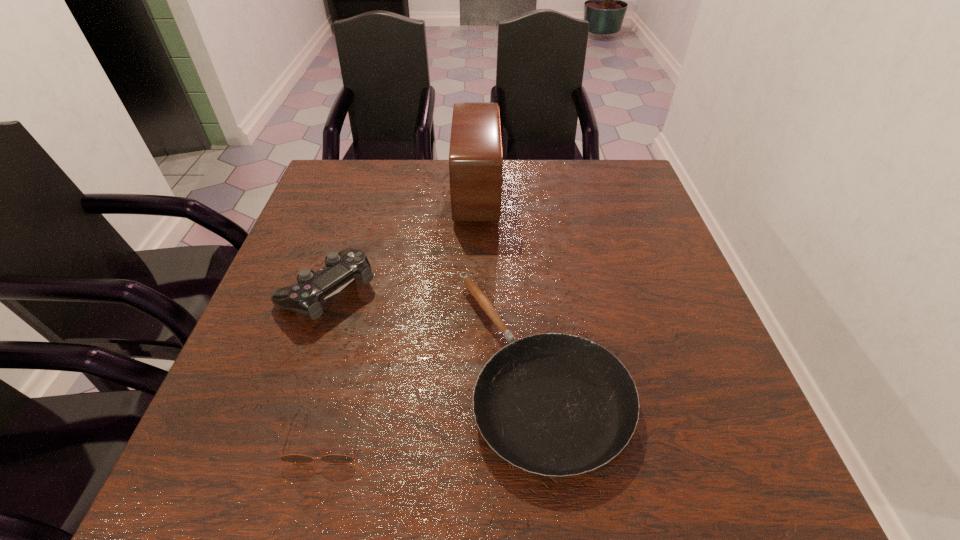
Where is `unoccupied position between the frying pan and the tallest object`? Image resolution: width=960 pixels, height=540 pixels. unoccupied position between the frying pan and the tallest object is located at coordinates (508, 280).

The width and height of the screenshot is (960, 540). Identify the location of free spot between the shortest object and the tallest object. (401, 316).

Where is `empty space between the second shortest object and the control`? empty space between the second shortest object and the control is located at coordinates (433, 328).

This screenshot has width=960, height=540. In order to click on vacant region between the shortest object and the farthest object in this screenshot , I will do `click(401, 316)`.

Locate an element on the screen. unoccupied area between the sunglasses and the second shortest object is located at coordinates (433, 403).

Locate an element on the screen. The width and height of the screenshot is (960, 540). free spot between the frying pan and the tallest object is located at coordinates (508, 280).

In order to click on free spot between the control and the shortest object in this screenshot , I will do `click(326, 364)`.

Where is `vacant space in between the shortest object and the tallest object`? vacant space in between the shortest object and the tallest object is located at coordinates (401, 316).

Locate an element on the screen. The height and width of the screenshot is (540, 960). vacant space that's between the second shortest object and the sunglasses is located at coordinates (433, 403).

Locate an element on the screen. free space between the frying pan and the farthest object is located at coordinates (508, 280).